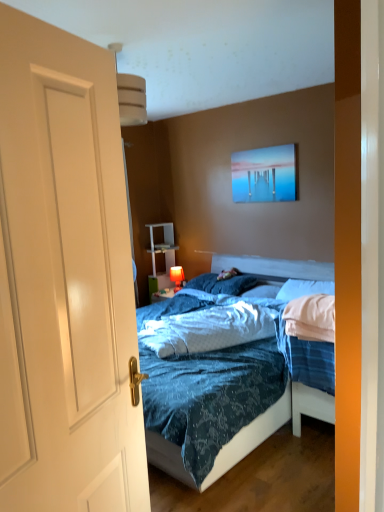
Question: Should I look upward or downward to see white soft pillow at center, placed as the 3th pillow when sorted from left to right?

Choices:
 (A) down
 (B) up

Answer: (A)

Question: Is white glossy door at center thinner than white glossy shelf at center?

Choices:
 (A) yes
 (B) no

Answer: (A)

Question: Is white glossy door at center further to camera compared to white glossy shelf at center?

Choices:
 (A) no
 (B) yes

Answer: (A)

Question: Is white glossy door at center turned away from white glossy shelf at center?

Choices:
 (A) no
 (B) yes

Answer: (A)

Question: Does white glossy door at center have a smaller size compared to white glossy shelf at center?

Choices:
 (A) no
 (B) yes

Answer: (B)

Question: From a real-world perspective, is white glossy door at center located beneath white glossy shelf at center?

Choices:
 (A) yes
 (B) no

Answer: (B)

Question: Does white glossy door at center have a greater width compared to white glossy shelf at center?

Choices:
 (A) no
 (B) yes

Answer: (A)

Question: Does white glossy shelf at center have a greater width compared to matte red lamp at center?

Choices:
 (A) no
 (B) yes

Answer: (B)

Question: From the image's perspective, would you say white glossy shelf at center is positioned over matte red lamp at center?

Choices:
 (A) no
 (B) yes

Answer: (B)

Question: Does white glossy shelf at center have a greater height compared to matte red lamp at center?

Choices:
 (A) yes
 (B) no

Answer: (A)

Question: From a real-world perspective, does white glossy shelf at center stand above matte red lamp at center?

Choices:
 (A) no
 (B) yes

Answer: (B)

Question: Does white glossy shelf at center appear on the right side of matte red lamp at center?

Choices:
 (A) no
 (B) yes

Answer: (A)

Question: Is white glossy shelf at center closer to camera compared to matte red lamp at center?

Choices:
 (A) no
 (B) yes

Answer: (A)

Question: From the image's perspective, would you say white soft pillow at center, acting as the 1th pillow starting from the right, is positioned over white soft pillow at center, the 2th pillow when ordered from right to left?

Choices:
 (A) yes
 (B) no

Answer: (A)